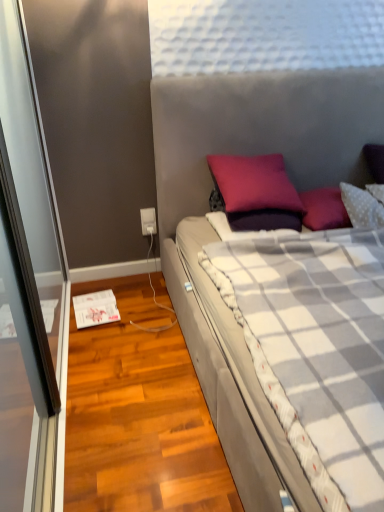
Question: From the image's perspective, relative to purple matte pillow at center, is white plastic power outlet at lower left above or below?

Choices:
 (A) above
 (B) below

Answer: (B)

Question: From a real-world perspective, is white plastic power outlet at lower left above or below purple matte pillow at center?

Choices:
 (A) below
 (B) above

Answer: (A)

Question: Based on their relative distances, which object is nearer to the plush gray bed at center?

Choices:
 (A) purple matte pillow at center
 (B) white plastic power outlet at lower left

Answer: (A)

Question: Considering the real-world distances, which object is farthest from the plush gray bed at center?

Choices:
 (A) purple matte pillow at center
 (B) white plastic power outlet at lower left

Answer: (B)